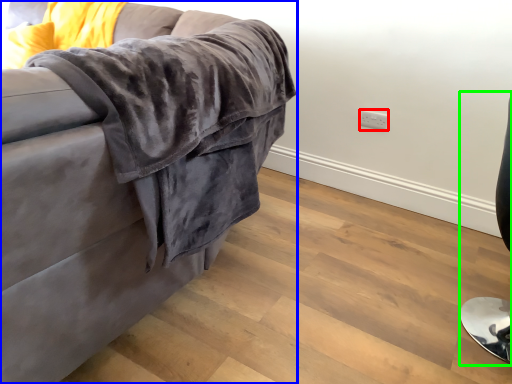
Question: Based on their relative distances, which object is farther from electric outlet (highlighted by a red box)? Choose from studio couch (highlighted by a blue box) and computer chair (highlighted by a green box).

Choices:
 (A) studio couch
 (B) computer chair

Answer: (A)